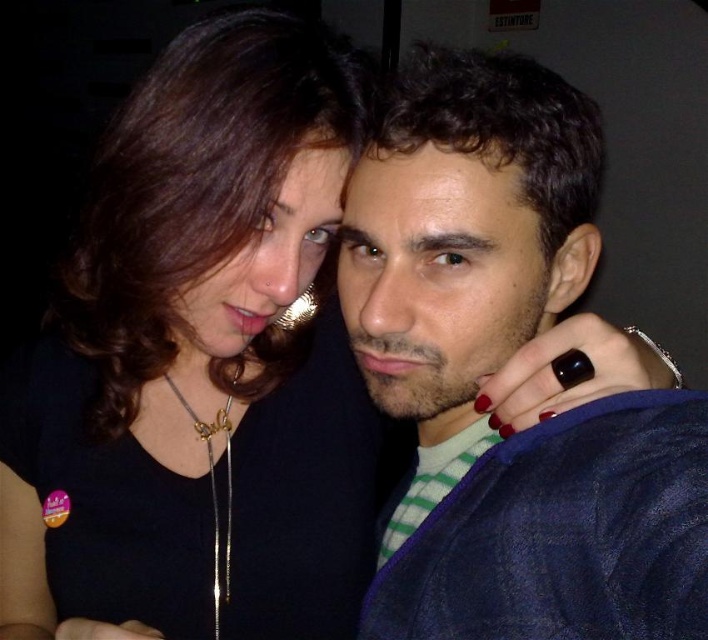
Question: Which point appears farthest from the camera in this image?

Choices:
 (A) (428, 616)
 (B) (309, 548)

Answer: (B)

Question: Can you confirm if black matte necklace at upper left is positioned to the left of dark blue denim jacket at center?

Choices:
 (A) yes
 (B) no

Answer: (A)

Question: Is dark blue denim jacket at center to the left of gold chain necklace at center from the viewer's perspective?

Choices:
 (A) yes
 (B) no

Answer: (B)

Question: Which object is the farthest from the gold chain necklace at center?

Choices:
 (A) dark blue denim jacket at center
 (B) black matte necklace at upper left

Answer: (A)

Question: Observing the image, what is the correct spatial positioning of black matte necklace at upper left in reference to dark blue denim jacket at center?

Choices:
 (A) above
 (B) below

Answer: (B)

Question: Among these objects, which one is nearest to the camera?

Choices:
 (A) gold chain necklace at center
 (B) black matte necklace at upper left

Answer: (B)